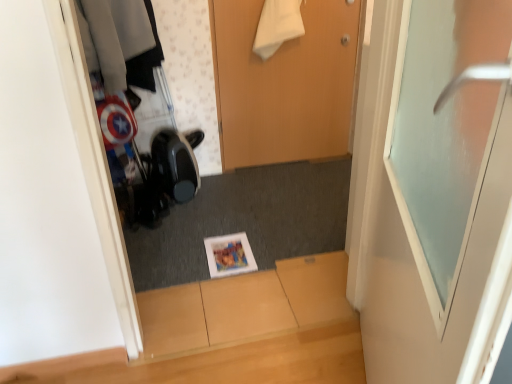
At what (x,y) coordinates should I click in order to perform the action: click on free location in front of matte paper magazine at center. Please return your answer as a coordinate pair (x, y). The height and width of the screenshot is (384, 512). Looking at the image, I should click on (227, 289).